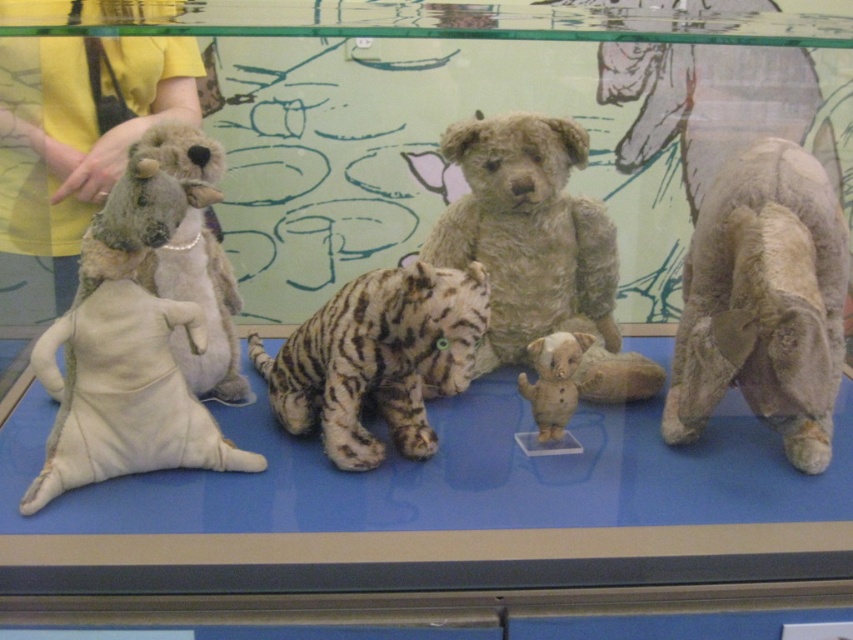
Question: Which object appears closest to the camera in this image?

Choices:
 (A) white plush elephant at center
 (B) fuzzy brown teddy bear at center
 (C) striped fur tiger at center
 (D) white plush kangaroo at left

Answer: (D)

Question: In this image, where is white plush kangaroo at left located relative to fuzzy brown teddy bear at center?

Choices:
 (A) right
 (B) left

Answer: (B)

Question: Is striped fur tiger at center to the right of white plush elephant at center from the viewer's perspective?

Choices:
 (A) no
 (B) yes

Answer: (A)

Question: Which point is closer to the camera?

Choices:
 (A) (809, 348)
 (B) (260, 353)
 (C) (494, 308)

Answer: (A)

Question: Estimate the real-world distances between objects in this image. Which object is closer to the fuzzy beige bear at right?

Choices:
 (A) fuzzy brown teddy bear at center
 (B) white plush elephant at center
 (C) white plush kangaroo at left
 (D) striped fur tiger at center

Answer: (B)

Question: Can you confirm if striped fur tiger at center is smaller than white plush elephant at center?

Choices:
 (A) yes
 (B) no

Answer: (B)